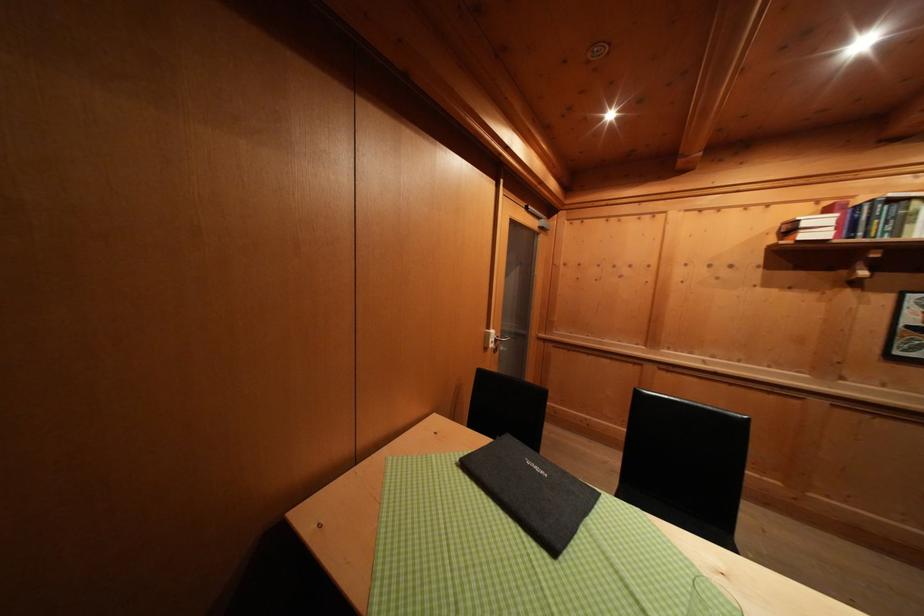
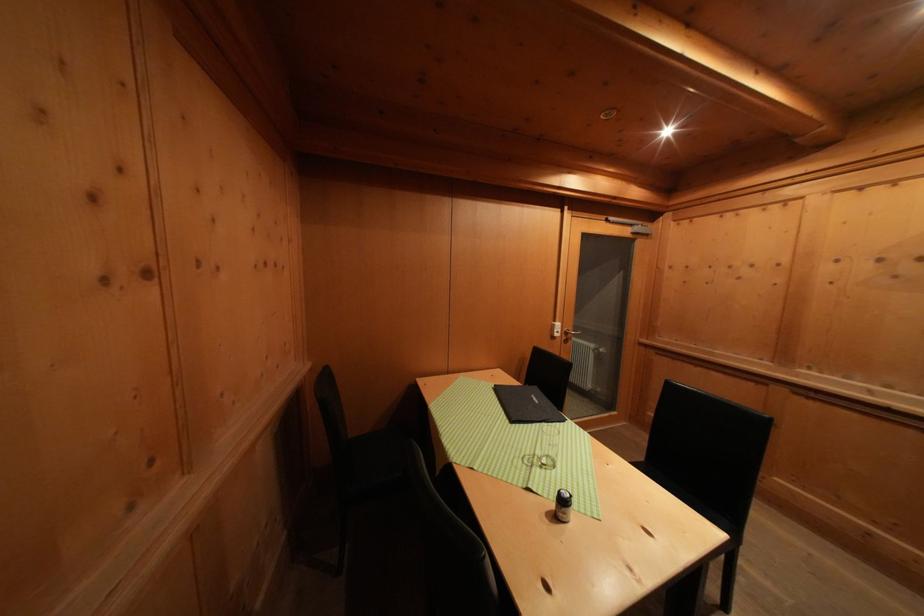
In the second image, find the point that corresponds to (x=548, y=477) in the first image.

(542, 406)